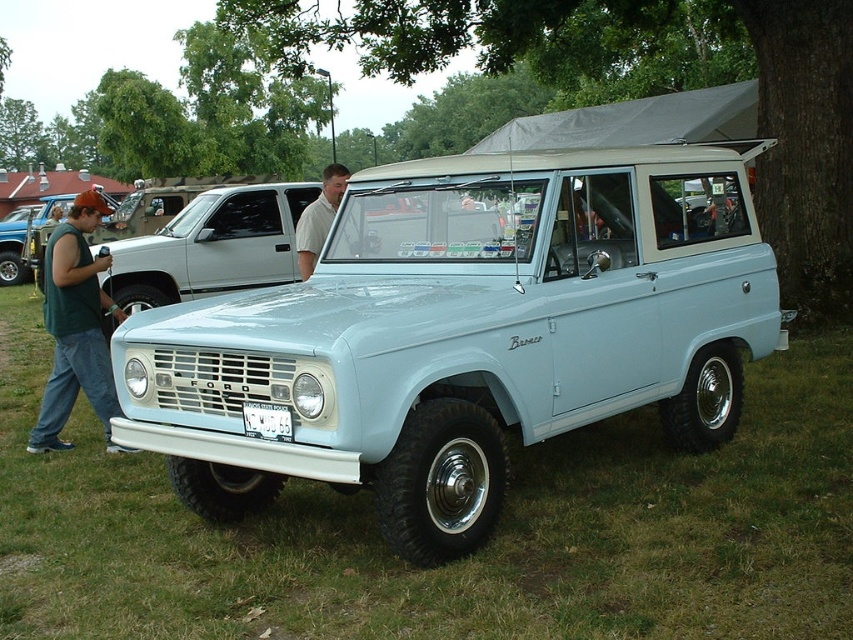
Question: Considering the relative positions of green sleeveless shirt at left and light beige shirt at center in the image provided, where is green sleeveless shirt at left located with respect to light beige shirt at center?

Choices:
 (A) below
 (B) above

Answer: (A)

Question: Estimate the real-world distances between objects in this image. Which object is farther from the green sleeveless shirt at left?

Choices:
 (A) matte black truck at left
 (B) light beige shirt at center
 (C) light blue matte bronco at center
 (D) light blue matte vehicle at center

Answer: (A)

Question: Which object is positioned farthest from the light blue matte bronco at center?

Choices:
 (A) light beige shirt at center
 (B) green sleeveless shirt at left
 (C) matte black truck at left

Answer: (C)

Question: Does light blue matte bronco at center appear on the left side of green sleeveless shirt at left?

Choices:
 (A) yes
 (B) no

Answer: (B)

Question: Which point is farther to the camera?

Choices:
 (A) green sleeveless shirt at left
 (B) light blue matte bronco at center
 (C) light beige shirt at center

Answer: (A)

Question: Can you confirm if light blue matte vehicle at center is smaller than light beige shirt at center?

Choices:
 (A) yes
 (B) no

Answer: (B)